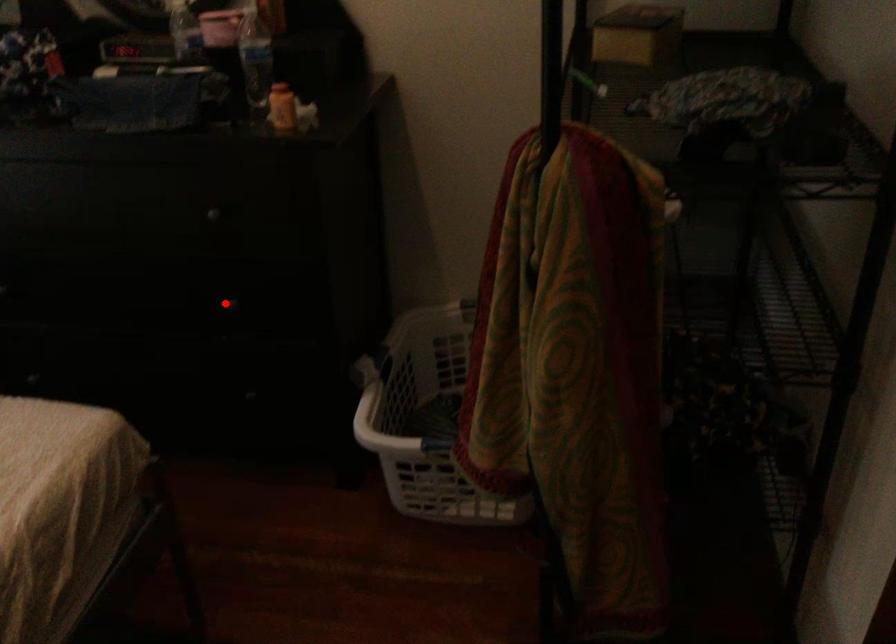
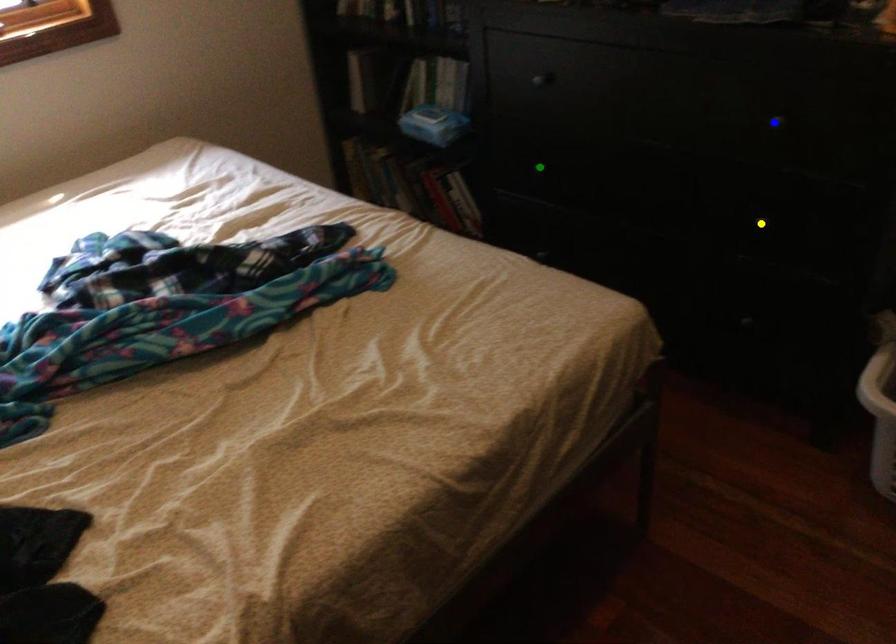
Question: I am providing you with two images of the same scene from different viewpoints. A red point is marked on the first image. You are given multiple points on the second image. Which mark in image 2 goes with the point in image 1?

Choices:
 (A) yellow point
 (B) green point
 (C) blue point

Answer: (A)